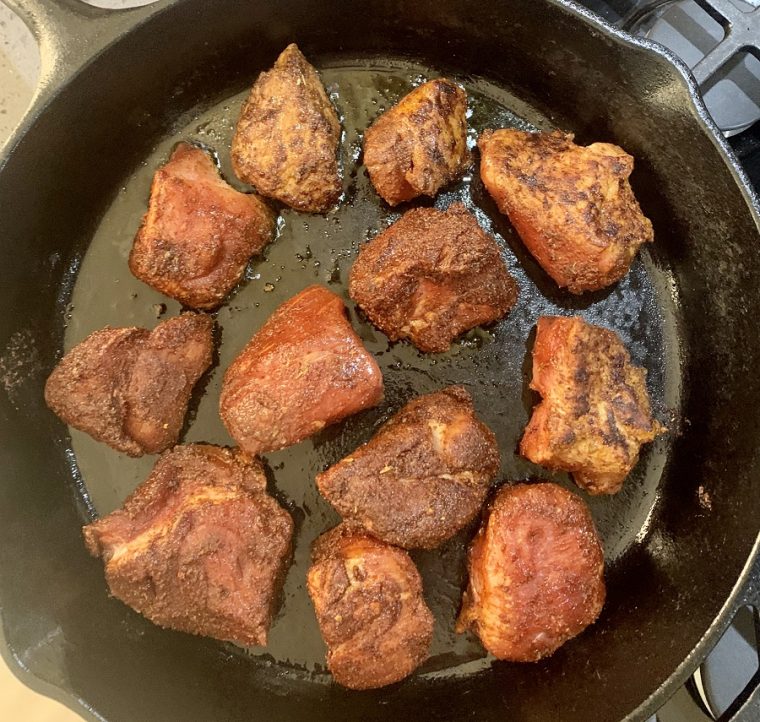
What are the coordinates of `handle` in the screenshot? It's located at (40, 9).